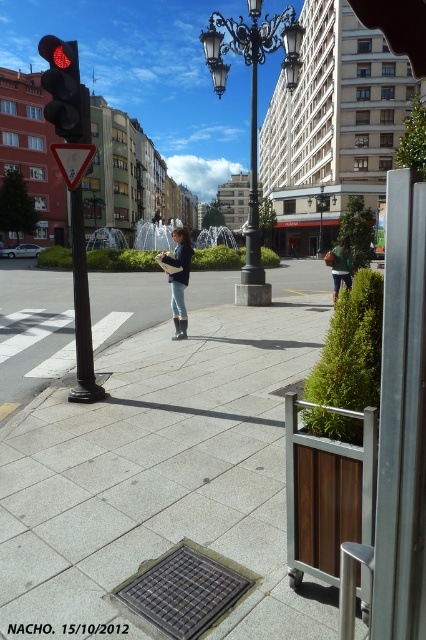
Can you confirm if black wrought iron streetlight at center is thinner than red matte traffic light at left?

In fact, black wrought iron streetlight at center might be wider than red matte traffic light at left.

Which is in front, point (270, 298) or point (66, 83)?

Point (66, 83)

Locate an element on the screen. black wrought iron streetlight at center is located at coordinates (253, 109).

Does black wrought iron streetlight at center appear on the left side of green fabric jacket at center?

No, black wrought iron streetlight at center is not to the left of green fabric jacket at center.

Between black wrought iron streetlight at center and green fabric jacket at center, which one appears on the left side from the viewer's perspective?

green fabric jacket at center

What do you see at coordinates (253, 109) in the screenshot?
I see `black wrought iron streetlight at center` at bounding box center [253, 109].

The image size is (426, 640). I want to click on black wrought iron streetlight at center, so [x=253, y=109].

Does gray concrete sidewalk at center have a lesser height compared to black wrought iron streetlight at center?

Indeed, gray concrete sidewalk at center has a lesser height compared to black wrought iron streetlight at center.

Is gray concrete sidewalk at center positioned behind black wrought iron streetlight at center?

No, it is not.

The height and width of the screenshot is (640, 426). I want to click on gray concrete sidewalk at center, so click(x=164, y=461).

Identify the location of gray concrete sidewalk at center. (164, 461).